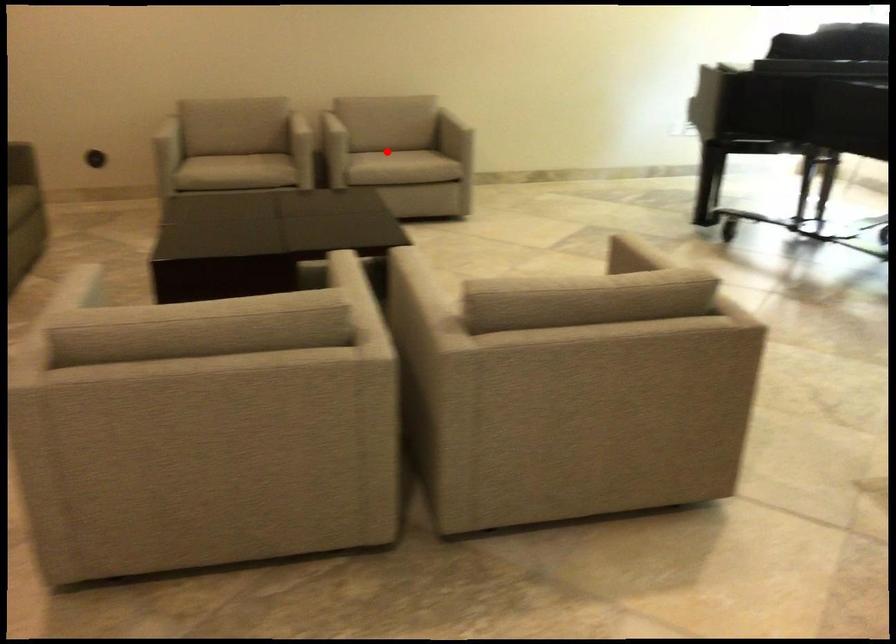
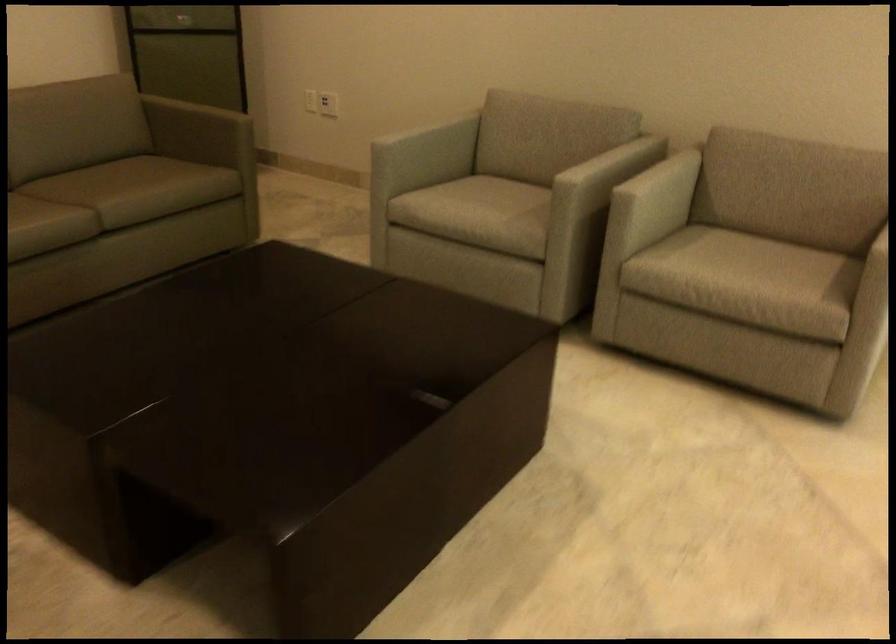
Question: A red point is marked in image1. In image2, is the corresponding 3D point closer to the camera or farther? Reply with the corresponding letter.

Choices:
 (A) The corresponding 3D point is closer.
 (B) The corresponding 3D point is farther.

Answer: (A)